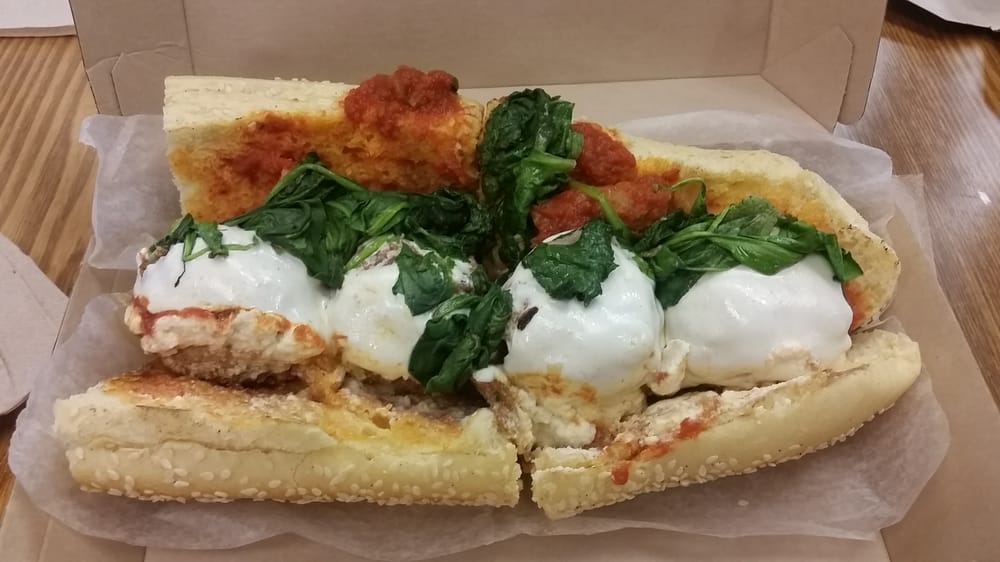
At what (x,y) coordinates should I click in order to perform the action: click on wood near the right hand side of the food. Please return your answer as a coordinate pair (x, y). This screenshot has height=562, width=1000. Looking at the image, I should click on (977, 232).